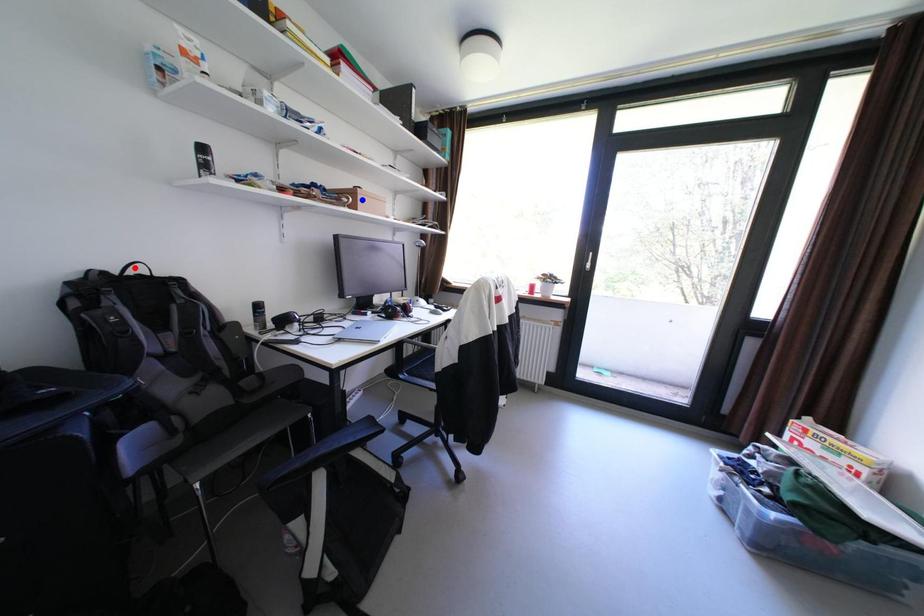
Question: Which of the two points in the image is closer to the camera?

Choices:
 (A) Blue point is closer.
 (B) Red point is closer.

Answer: (B)